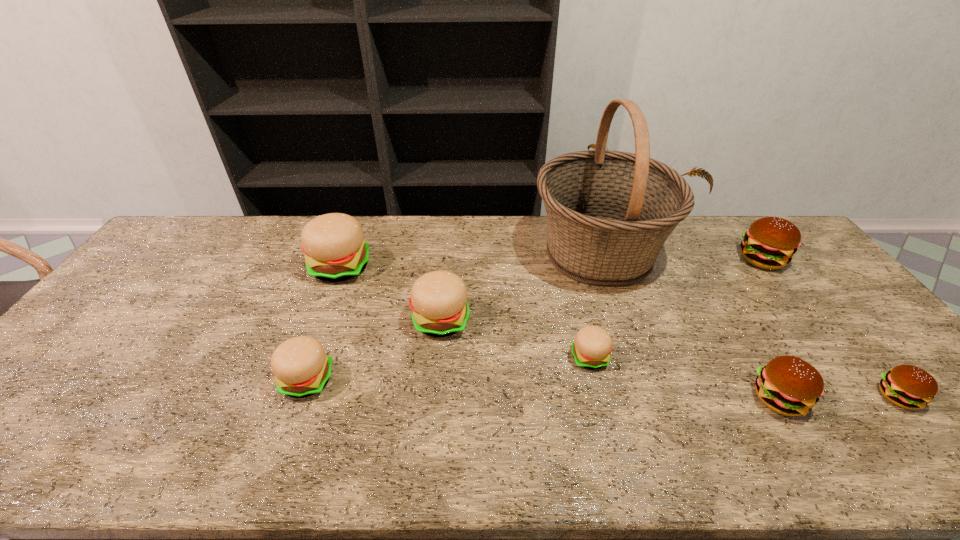
Locate an element on the screen. the rightmost beige hamburger is located at coordinates (591, 349).

At what (x,y) coordinates should I click in order to perform the action: click on blank area located 0.130m on the front of the tallest object. Please return your answer as a coordinate pair (x, y). Image resolution: width=960 pixels, height=540 pixels. Looking at the image, I should click on (625, 332).

The height and width of the screenshot is (540, 960). Identify the location of vacant position located on the right of the biggest beige hamburger. (465, 267).

Locate an element on the screen. The width and height of the screenshot is (960, 540). vacant space located 0.150m on the front of the farthest brown hamburger is located at coordinates point(800,309).

Locate an element on the screen. Image resolution: width=960 pixels, height=540 pixels. free space located 0.200m on the back of the second biggest beige hamburger is located at coordinates (446, 259).

Identify the location of free spot located on the back of the sixth object from left to right. (711, 285).

Locate an element on the screen. vacant space located 0.380m on the left of the second smallest beige hamburger is located at coordinates (126, 380).

Locate an element on the screen. The height and width of the screenshot is (540, 960). free spot located on the back of the smallest brown hamburger is located at coordinates (814, 296).

Where is `vacant space situated on the front of the fourth hamburger from right to left`? This screenshot has height=540, width=960. vacant space situated on the front of the fourth hamburger from right to left is located at coordinates (599, 396).

Where is `basket at the far edge`? This screenshot has height=540, width=960. basket at the far edge is located at coordinates (609, 213).